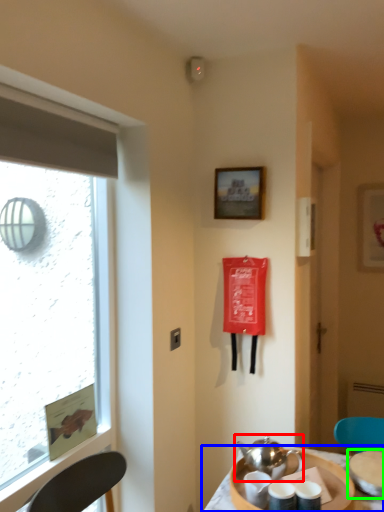
Question: Considering the real-world distances, which object is farthest from tea set (highlighted by a red box)? table (highlighted by a blue box) or tableware (highlighted by a green box)?

Choices:
 (A) table
 (B) tableware

Answer: (B)